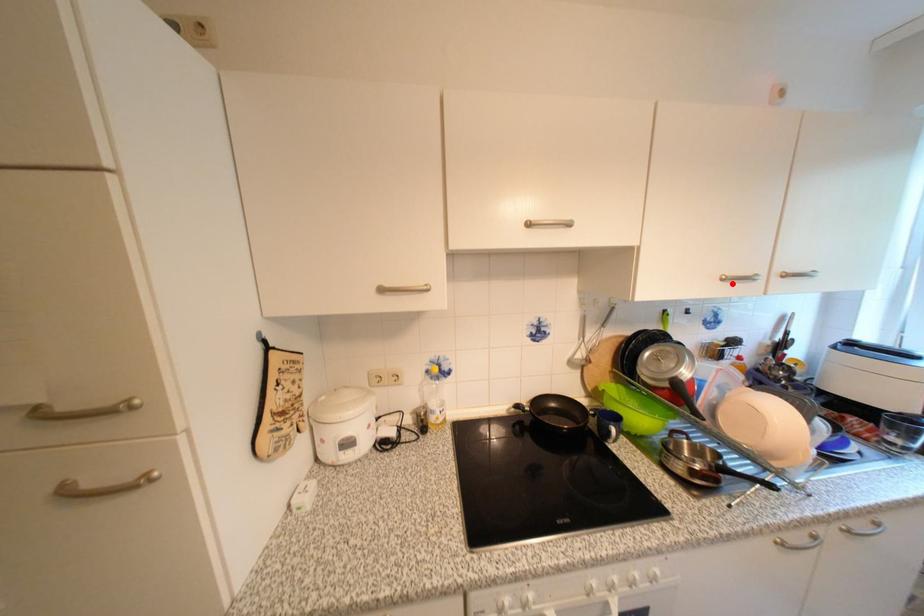
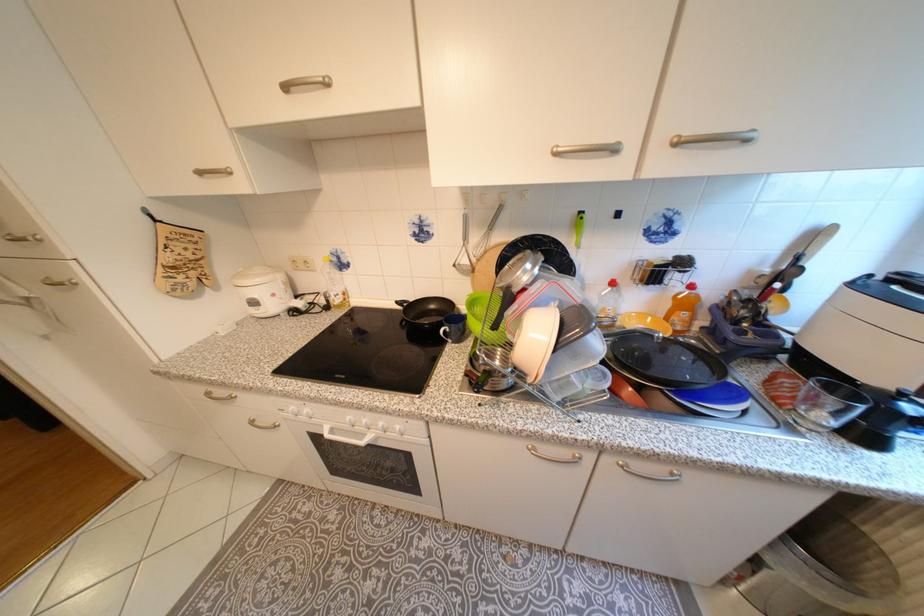
Locate, in the second image, the point that corresponds to the highlighted location in the first image.

(565, 160)